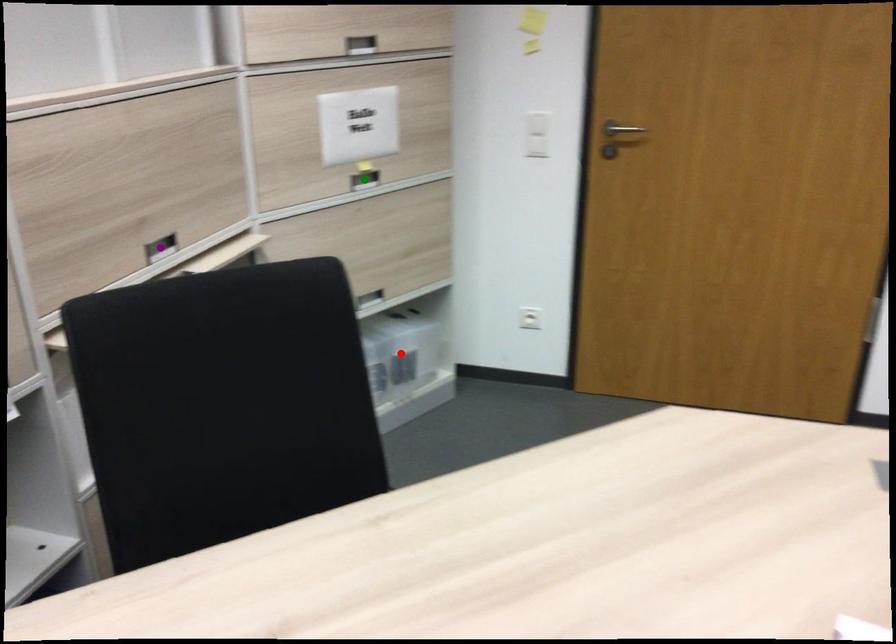
Order these from nearest to farthest:
- green point
- red point
- purple point

purple point → green point → red point